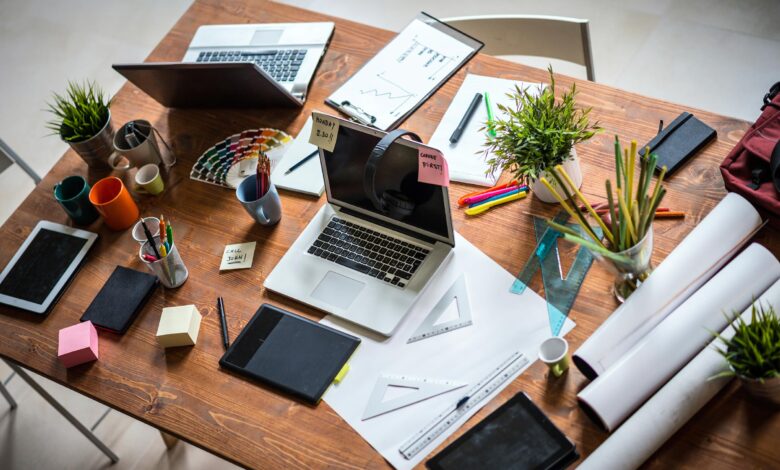
Where is `sticky note`? This screenshot has height=470, width=780. sticky note is located at coordinates (176, 319), (73, 339), (236, 254), (434, 168), (320, 136).